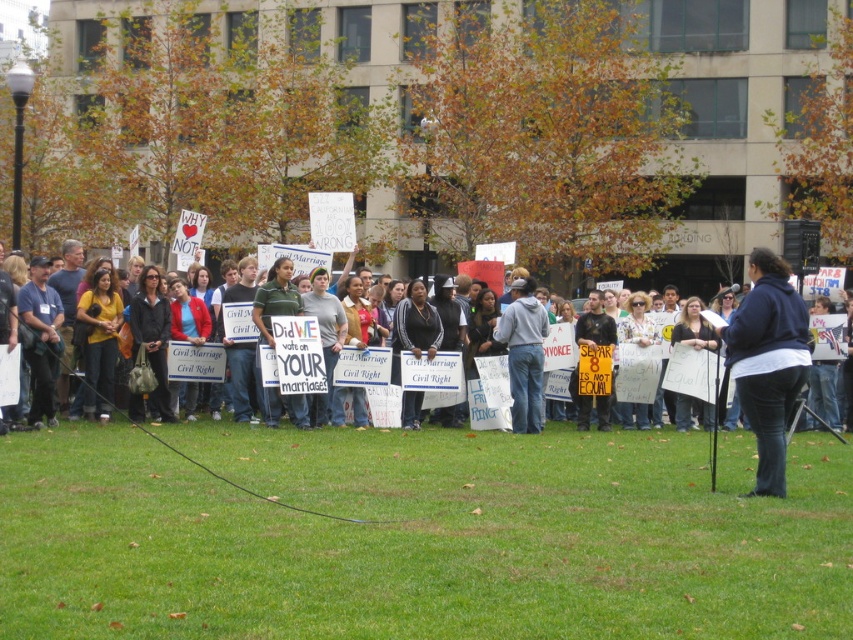
Question: Can you confirm if green grass at lower center is positioned to the right of denim jeans at center?

Choices:
 (A) yes
 (B) no

Answer: (B)

Question: Which point appears closest to the camera in this image?

Choices:
 (A) (572, 440)
 (B) (762, 460)

Answer: (B)

Question: Does green grass at lower center appear on the right side of dark blue jeans at center?

Choices:
 (A) no
 (B) yes

Answer: (A)

Question: Can you confirm if green grass at lower center is positioned to the right of denim jeans at center?

Choices:
 (A) yes
 (B) no

Answer: (B)

Question: Which point is farther to the camera?

Choices:
 (A) (523, 310)
 (B) (787, 308)

Answer: (A)

Question: Which object is farther from the camera taking this photo?

Choices:
 (A) dark blue jeans at center
 (B) dark blue hoodie at center

Answer: (A)